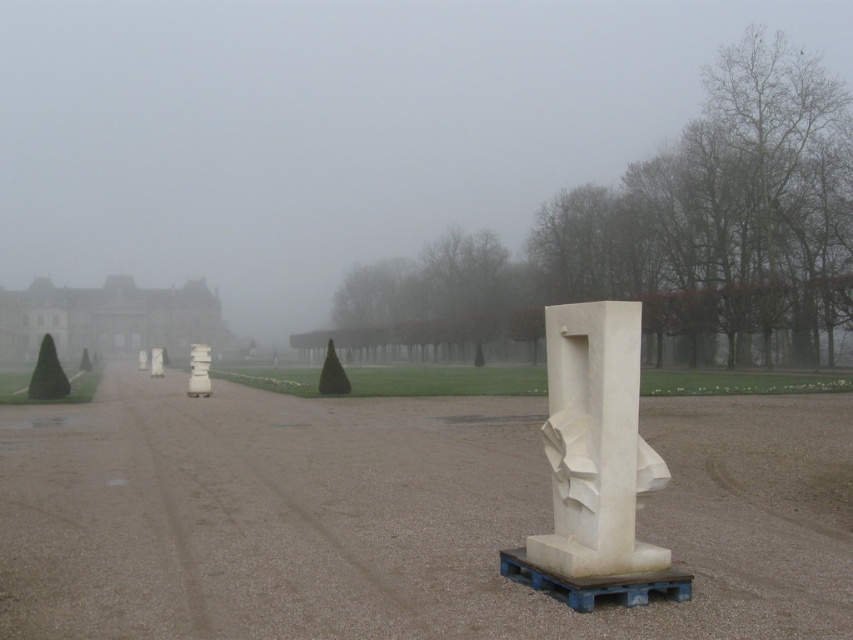
You are standing on the brown gravel dirt track at center and want to reach the white stone palace at left. According to the scene, which direction should you walk to get there?

The brown gravel dirt track at center is in front of the white stone palace at left, so you should walk backward to reach the white stone palace at left.

Consider the image. You are standing at the entrance of the garden and want to locate the white marble sculpture at center. According to the coordinates provided, in which direction should you move to find it?

The white marble sculpture at center is located at coordinates point (595,465), so you should move towards the center of the image to find it.

Consider the image. You are a tour guide leading visitors through the foggy garden. You want to point out both the white marble sculpture at center and the white stone palace at left. Which one should you mention first so that visitors can see it more clearly through the fog?

You should mention the white marble sculpture at center first because it is closer to the viewer, making it more visible through the fog compared to the white stone palace at left, which is farther away.